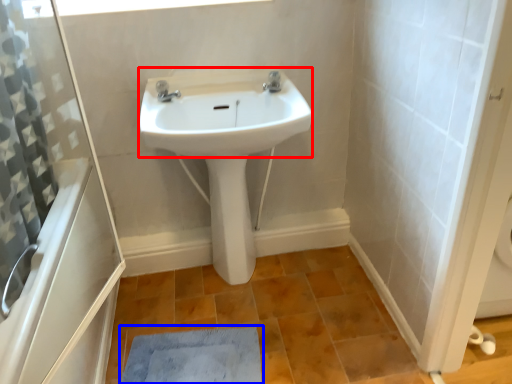
Question: Which of the following is the farthest to the observer, sink (highlighted by a red box) or doormat (highlighted by a blue box)?

Choices:
 (A) sink
 (B) doormat

Answer: (B)